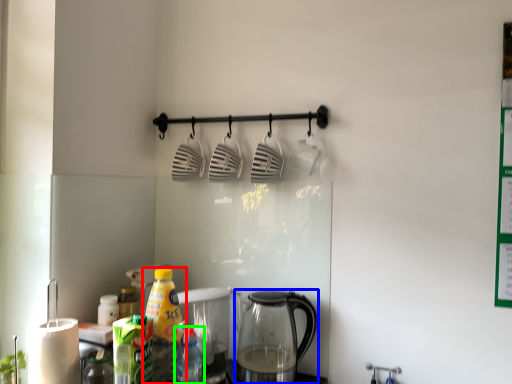
Question: Which object is the farthest from bottle (highlighted by a red box)? Choose among these: kettle (highlighted by a blue box) or bottle (highlighted by a green box).

Choices:
 (A) kettle
 (B) bottle

Answer: (A)